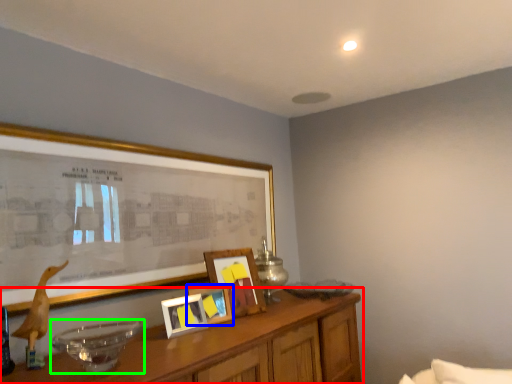
Question: Which object is positioned farthest from table (highlighted by a red box)? Select from picture frame (highlighted by a blue box) and glass bowl (highlighted by a green box).

Choices:
 (A) picture frame
 (B) glass bowl

Answer: (B)